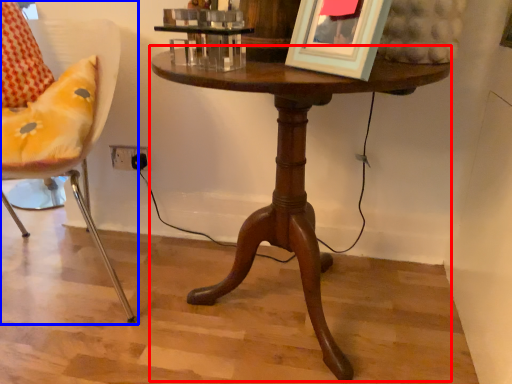
Question: Which of the following is the closest to the observer, table (highlighted by a red box) or chair (highlighted by a blue box)?

Choices:
 (A) table
 (B) chair

Answer: (A)